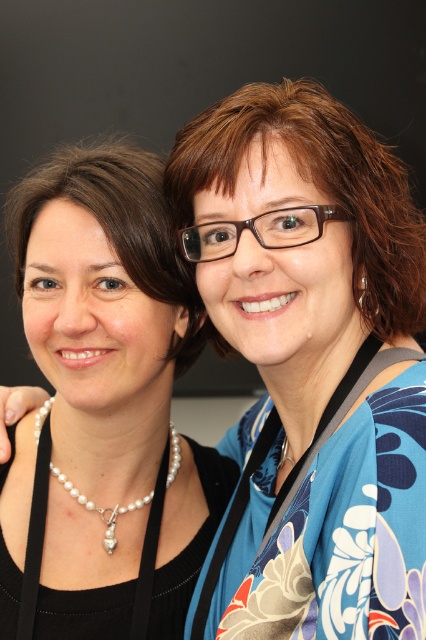
Based on the photo, you are a photographer adjusting your camera settings. You notice the blue floral kimono at center and the pearl necklace at left. Which object should you focus on if you want to capture the foreground element more clearly?

The blue floral kimono at center is closer to the viewer than the pearl necklace at left, so focusing on the blue floral kimono at center will capture the foreground element more clearly.

You are a photographer trying to capture a closeup of the blue floral kimono at center and the pearl necklace at left. Which object should you zoom in on first to ensure it fits within the frame?

The blue floral kimono at center is larger in size than the pearl necklace at left, so you should zoom in on the pearl necklace at left first to ensure it fits within the frame before adjusting for the larger kimono.